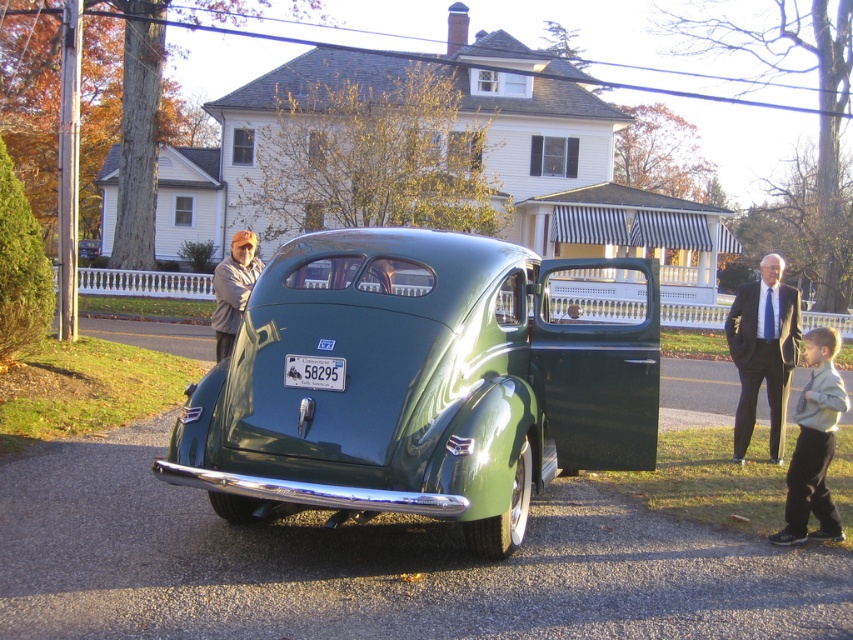
You are a photographer standing at the camera position. You need to capture a photo of the shiny green car at center without including the dark gray suit at right in the frame. Is this possible based on their positions?

The shiny green car at center is located above the dark gray suit at right, so if you position yourself to focus on the car, you can exclude the dark gray suit at right from the lower part of the frame.

You are a tailor who needs to determine which clothing item requires more fabric for alterations. Based on the image, which item is wider between the dark gray suit at right and the gray wool jacket at left?

The gray wool jacket at left is wider than the dark gray suit at right, so it would require more fabric for alterations.